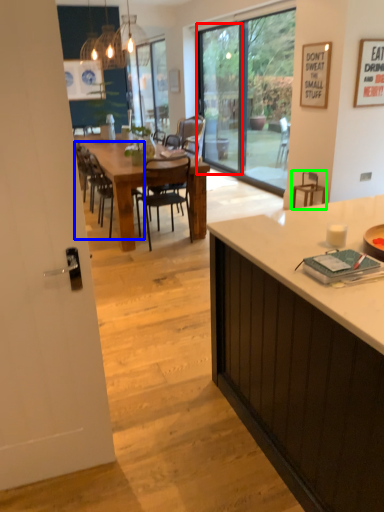
Question: Which is farther away from screen door (highlighted by a red box)? chair (highlighted by a blue box) or armchair (highlighted by a green box)?

Choices:
 (A) chair
 (B) armchair

Answer: (A)